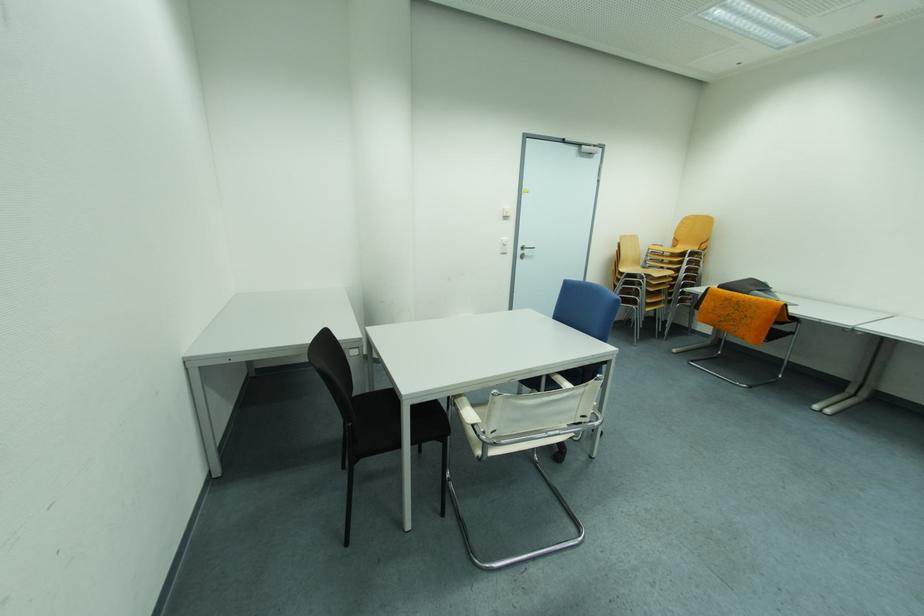
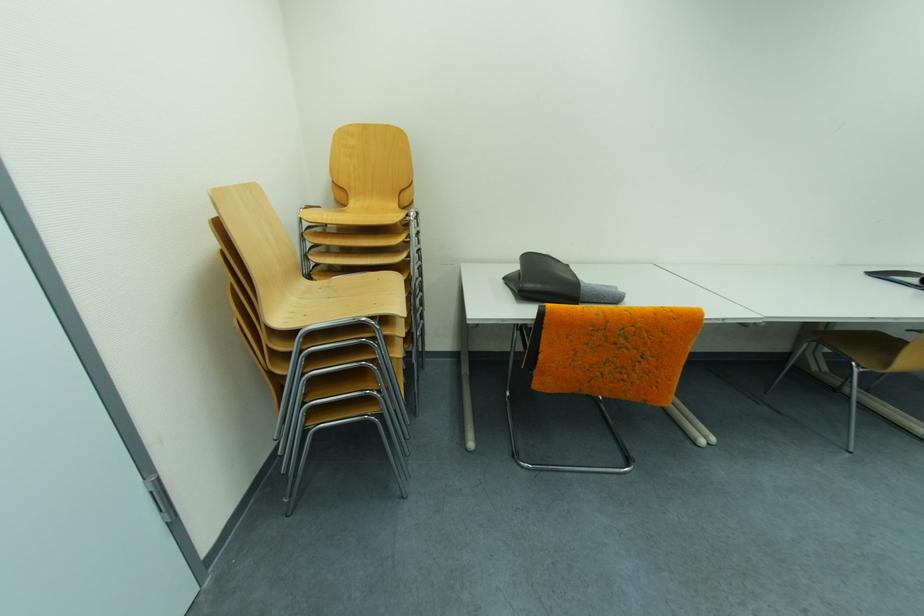
Find the pixel in the second image that matches point (687, 245) in the first image.

(359, 197)